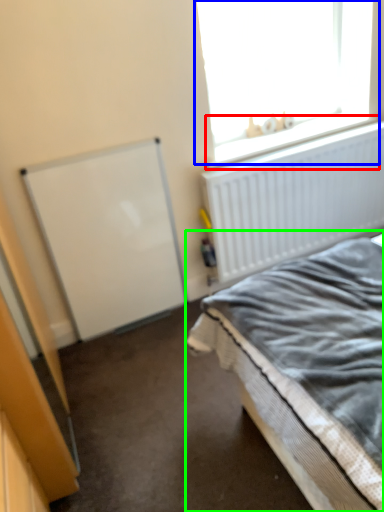
Question: Which object is the closest to the window sill (highlighted by a red box)? Choose among these: window (highlighted by a blue box) or bed (highlighted by a green box).

Choices:
 (A) window
 (B) bed

Answer: (A)